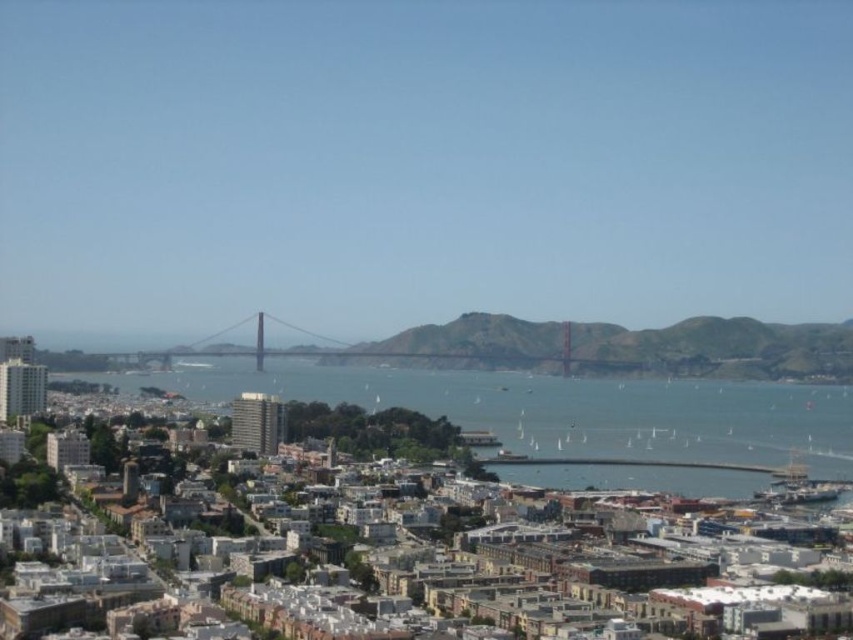
Question: Is blue water at center above metallic bridge at center?

Choices:
 (A) no
 (B) yes

Answer: (A)

Question: Is blue water at center to the right of metallic bridge at center from the viewer's perspective?

Choices:
 (A) yes
 (B) no

Answer: (A)

Question: Which of the following is the closest to the observer?

Choices:
 (A) (155, 356)
 (B) (715, 380)

Answer: (A)

Question: Among these points, which one is farthest from the camera?

Choices:
 (A) (491, 355)
 (B) (595, 474)

Answer: (B)

Question: Observing the image, what is the correct spatial positioning of blue water at center in reference to metallic bridge at center?

Choices:
 (A) above
 (B) below

Answer: (B)